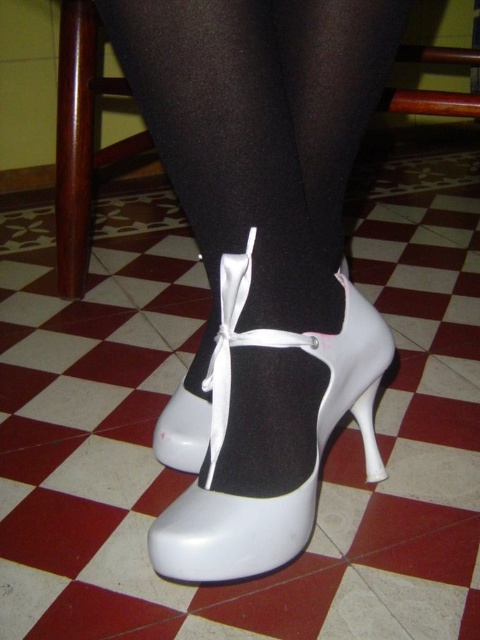
You are a photographer adjusting the lighting in a studio. You notice a point at coordinates [226,433] in the image. Based on the scene, where is this point located?

The point at coordinates [226,433] is located on the white matte high heeled shoe at center.

In the scene shown: You are a fashion designer observing the footwear in the image. You need to determine the spatial arrangement between the white satin shoe at center and the white matte heel at lower center. Which object is positioned to the left?

The white satin shoe at center is positioned to the left of the white matte heel at lower center.

You are an interior designer planning to place a decorative item exactly at the coordinates mentioned in the scene description. The item must be placed where the white satin shoe at center currently stands. Which object in the scene is located at the coordinates you need to consider for placing the item?

The white satin shoe at center is located at the coordinates mentioned, so you should place the decorative item where the white satin shoe at center is currently positioned.